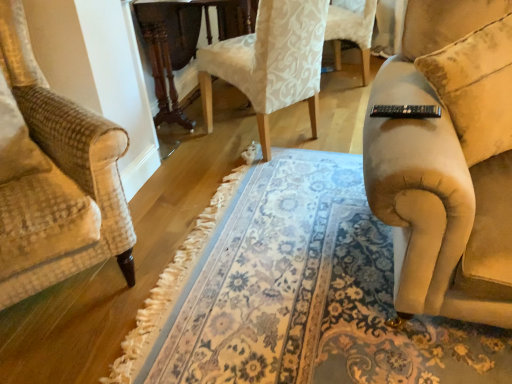
Question: From a real-world perspective, is dark wood round table at center physically located above or below floral carpet at center?

Choices:
 (A) above
 (B) below

Answer: (A)

Question: Is point (185, 59) positioned closer to the camera than point (174, 266)?

Choices:
 (A) closer
 (B) farther

Answer: (B)

Question: Estimate the real-world distances between objects in this image. Which object is farther from the dark wood round table at center?

Choices:
 (A) beige fabric couch at right
 (B) floral carpet at center
 (C) white damask fabric chair at center

Answer: (A)

Question: Based on their relative distances, which object is farther from the beige fabric couch at right?

Choices:
 (A) dark wood round table at center
 (B) floral carpet at center
 (C) white damask fabric chair at center

Answer: (A)